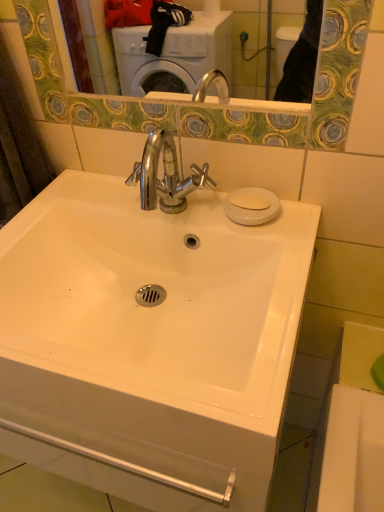
Where is `free spot to the right of white matte soap at upper right`? This screenshot has height=512, width=384. free spot to the right of white matte soap at upper right is located at coordinates [x=292, y=209].